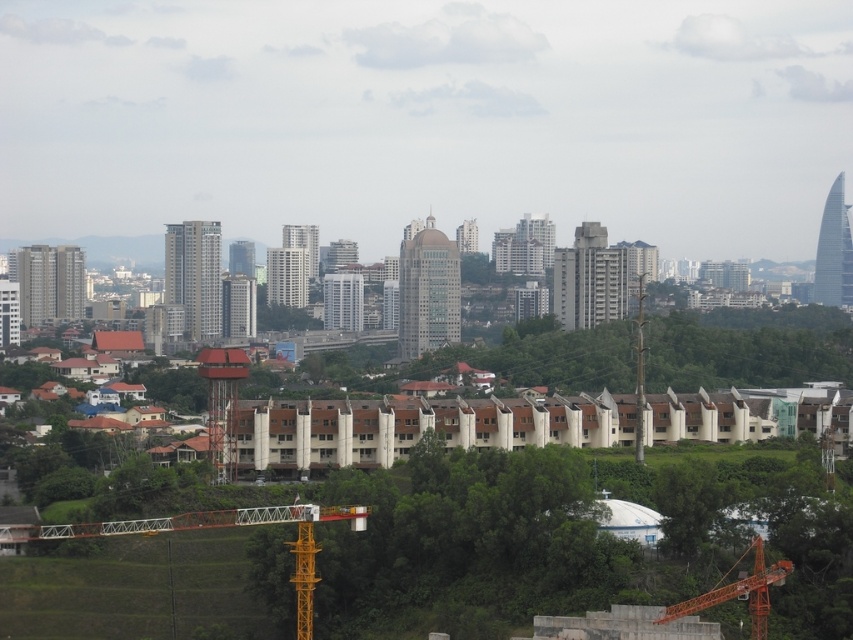
Does orange metallic crane at lower left appear on the right side of orange metallic crane at lower right?

Incorrect, orange metallic crane at lower left is not on the right side of orange metallic crane at lower right.

Is orange metallic crane at lower left closer to the viewer compared to orange metallic crane at lower right?

Yes, orange metallic crane at lower left is in front of orange metallic crane at lower right.

Where is `orange metallic crane at lower left`? This screenshot has height=640, width=853. orange metallic crane at lower left is located at coordinates (215, 528).